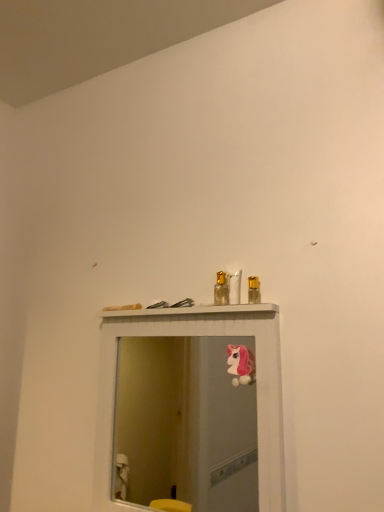
Question: Does metallic gold spray can at upper center, which is the 1th toiletry in right-to-left order, lie behind pink plush unicorn at upper center?

Choices:
 (A) yes
 (B) no

Answer: (A)

Question: Can you confirm if metallic gold spray can at upper center, which is the 1th toiletry in right-to-left order, is positioned to the right of pink plush unicorn at upper center?

Choices:
 (A) no
 (B) yes

Answer: (B)

Question: Is metallic gold spray can at upper center, which is the 1th toiletry in right-to-left order, touching pink plush unicorn at upper center?

Choices:
 (A) no
 (B) yes

Answer: (A)

Question: Can you confirm if metallic gold spray can at upper center, which is the 1th toiletry in right-to-left order, is thinner than pink plush unicorn at upper center?

Choices:
 (A) yes
 (B) no

Answer: (A)

Question: Is metallic gold spray can at upper center, positioned as the 2th toiletry in left-to-right order, positioned far away from pink plush unicorn at upper center?

Choices:
 (A) no
 (B) yes

Answer: (B)

Question: Looking at their shapes, would you say white glossy mirror at upper center is wider or thinner than gold metallic perfume bottle at center, arranged as the first toiletry when viewed from the left?

Choices:
 (A) wide
 (B) thin

Answer: (A)

Question: Is white glossy mirror at upper center bigger or smaller than gold metallic perfume bottle at center, the 2th toiletry in the right-to-left sequence?

Choices:
 (A) big
 (B) small

Answer: (A)

Question: Is point (160, 458) positioned closer to the camera than point (225, 284)?

Choices:
 (A) farther
 (B) closer

Answer: (A)

Question: Choose the correct answer: Is white glossy mirror at upper center inside gold metallic perfume bottle at center, the 2th toiletry in the right-to-left sequence, or outside it?

Choices:
 (A) inside
 (B) outside

Answer: (B)

Question: From a real-world perspective, relative to pink plush unicorn at upper center, is gold metallic perfume bottle at center, arranged as the first toiletry when viewed from the left, vertically above or below?

Choices:
 (A) above
 (B) below

Answer: (A)

Question: Considering the positions of point (226, 274) and point (249, 359), is point (226, 274) closer or farther from the camera than point (249, 359)?

Choices:
 (A) farther
 (B) closer

Answer: (B)

Question: In the image, is gold metallic perfume bottle at center, the 2th toiletry in the right-to-left sequence, positioned in front of or behind pink plush unicorn at upper center?

Choices:
 (A) front
 (B) behind

Answer: (B)

Question: Is gold metallic perfume bottle at center, the 2th toiletry in the right-to-left sequence, wider or thinner than pink plush unicorn at upper center?

Choices:
 (A) wide
 (B) thin

Answer: (B)

Question: Looking at their shapes, would you say pink plush unicorn at upper center is wider or thinner than white glossy mirror at upper center?

Choices:
 (A) wide
 (B) thin

Answer: (B)

Question: From the image's perspective, is pink plush unicorn at upper center above or below white glossy mirror at upper center?

Choices:
 (A) below
 (B) above

Answer: (B)